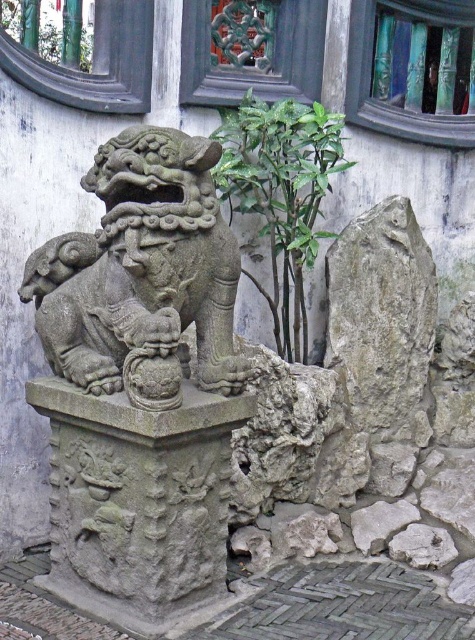
You are an artist trying to sketch the scene. You need to decide which object to draw first based on their sizes. Which object should you start with, the gray stone lion at center or the gray rough rock at center?

The gray stone lion at center has a larger width than the gray rough rock at center, so you should start by drawing the gray stone lion at center first since it is bigger and will form the main focus of the sketch.

Consider the image. You are standing in front of a traditional Chinese stone lion statue. The statue is on a pedestal. There is a point marked at coordinates (138, 502). What does this point represent?

The point at coordinates (138, 502) marks the gray stone pedestal at center.

You are an architect reviewing a blueprint and notice the gray stone pedestal at center. What are its coordinates on the blueprint?

The gray stone pedestal at center is located at coordinates point (138, 502).